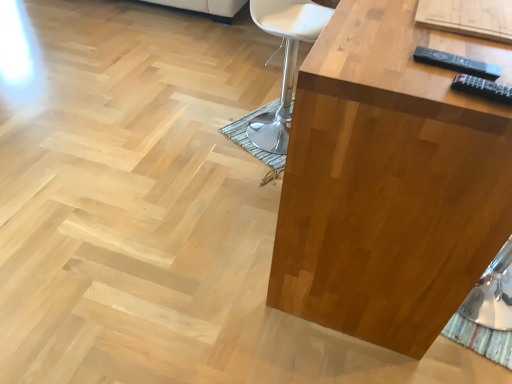
The height and width of the screenshot is (384, 512). What are the coordinates of `free space to the left of black plastic remote at upper right, arranged as the first remote when ordered from the bottom` in the screenshot? It's located at (414, 79).